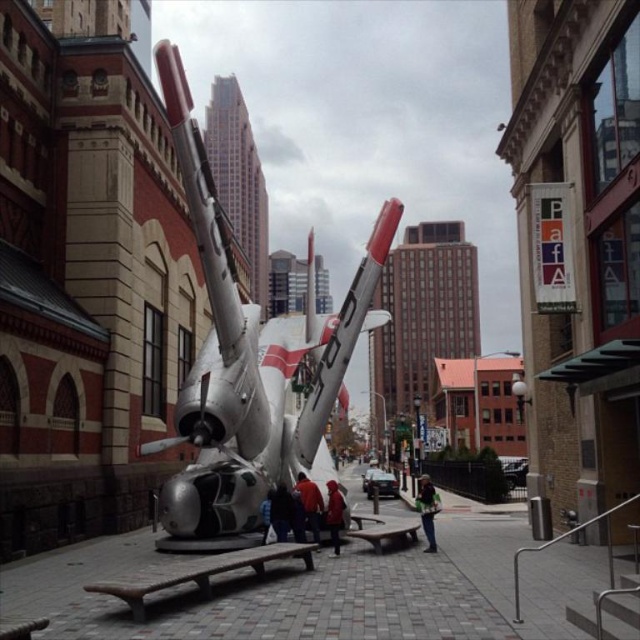
You are a passerby on the sidewalk and see both the red fabric jacket at center and the red jacket at center. Which one is positioned more to the left?

The red fabric jacket at center is positioned more to the left than the red jacket at center.

In the scene shown: You are a city planner assessing the space between the two buildings where the airplane sculpture is placed. There are dark blue jeans at center. Can you determine if the distance between the two buildings is sufficient to accommodate a new 60 meter long temporary art installation? Please provide your answer based on the available information.

The dark blue jeans at center are 61.94 meters apart. Since the distance between them is 61.94 meters, which is greater than the 60 meter length of the art installation, the space is sufficient to accommodate it.

You are a delivery person trying to navigate through the street. You see the silver metallic airplane at center and the green fabric jacket at center. Which object is wider? Please answer based on their widths.

The silver metallic airplane at center is wider than the green fabric jacket at center according to the description.